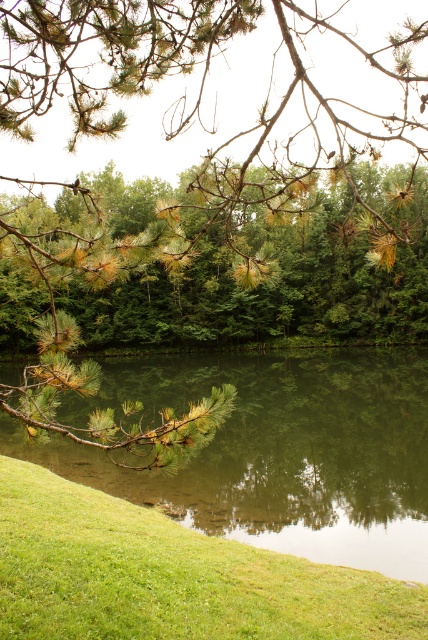
You are standing at the water edge in the scene. Where is the green reflective water at lower center located relative to your position?

The green reflective water at lower center is located at point 0.705 on the x axis and 0.650 on the y axis relative to your position.